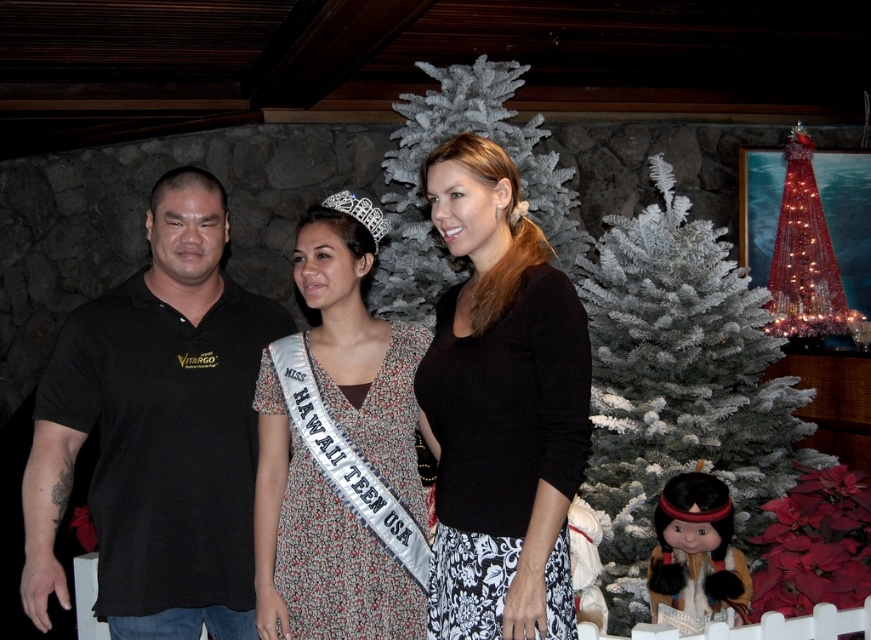
Between floral-patterned fabric dress at center and white artificial christmas tree at center, which one is positioned lower?

floral-patterned fabric dress at center is lower down.

The image size is (871, 640). Describe the element at coordinates (336, 564) in the screenshot. I see `floral-patterned fabric dress at center` at that location.

Which is behind, point (416, 513) or point (557, 257)?

Point (557, 257)

Locate an element on the screen. The height and width of the screenshot is (640, 871). floral-patterned fabric dress at center is located at coordinates (336, 564).

Who is more distant from viewer, (527, 420) or (321, 497)?

Positioned behind is point (321, 497).

Measure the distance between point (517, 426) and camera.

Point (517, 426) and camera are 1.61 meters apart.

The width and height of the screenshot is (871, 640). Find the location of `black ribbed sweater at center`. black ribbed sweater at center is located at coordinates (501, 406).

Does floral-patterned fabric dress at center have a larger size compared to matte black doll at lower right?

Yes, floral-patterned fabric dress at center is bigger than matte black doll at lower right.

Does point (410, 380) lie in front of point (666, 524)?

Yes.

In order to click on floral-patterned fabric dress at center in this screenshot , I will do `click(336, 564)`.